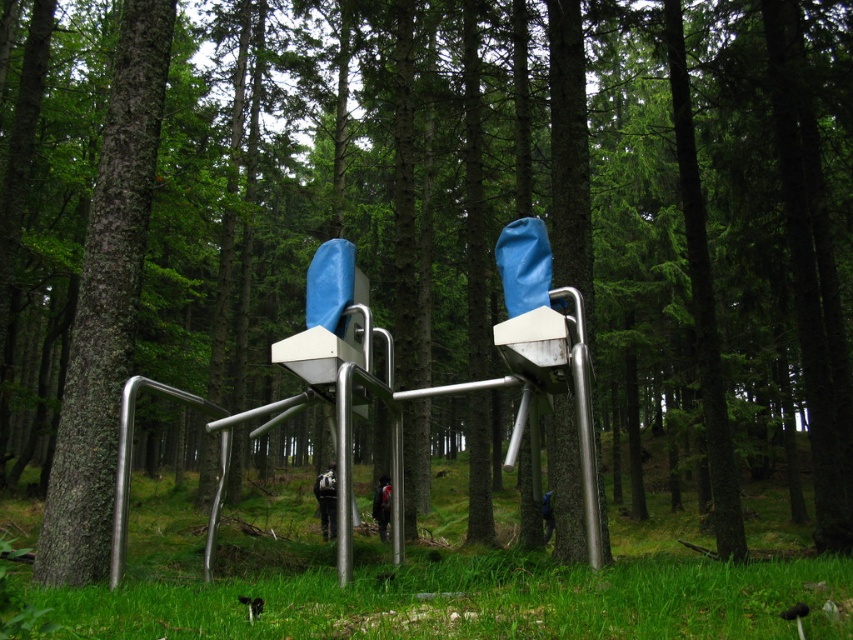
You are a hiker who wants to sit on the green grass at center but need to avoid the smooth brown tree trunk at left. Can you safely move from your current position to the grass without hitting the tree trunk?

The green grass at center is taller than the smooth brown tree trunk at left, so you can safely move to the grass as the tree trunk is shorter and less obstructive.

You are a hiker who wants to place a small flag exactly halfway between the green grass at center and the smooth brown tree trunk at left. Based on the scene, where would the flag be positioned relative to the tree trunk?

The flag would be positioned halfway between the green grass at center and the smooth brown tree trunk at left, which means it would be halfway below the tree trunk since the grass is below the tree trunk.